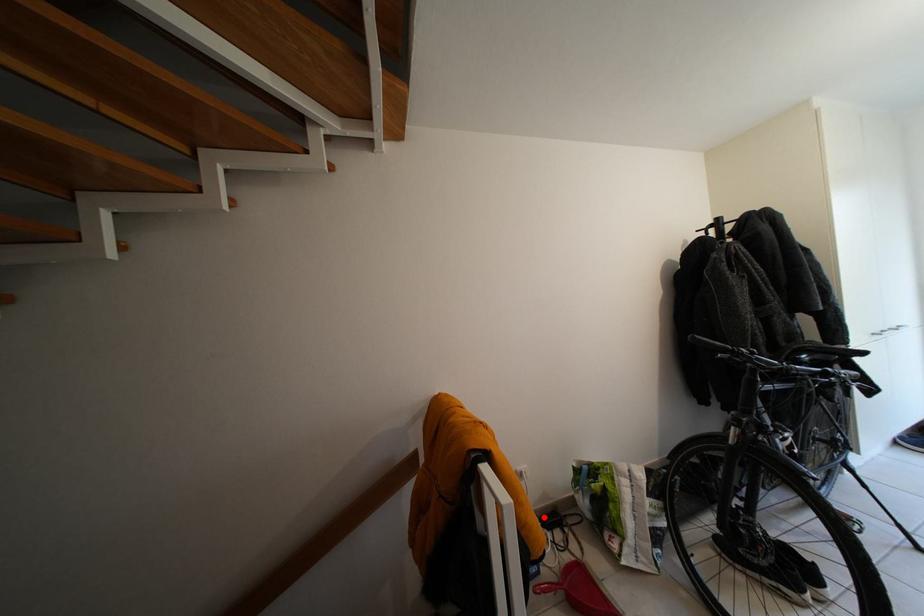
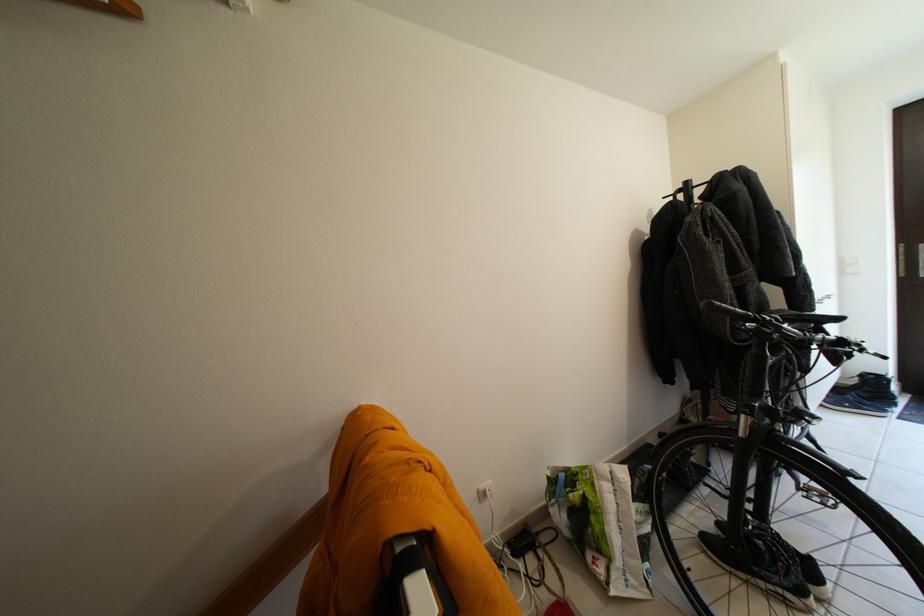
Where in the second image is the point corresponding to the highlighted location from the first image?

(512, 541)